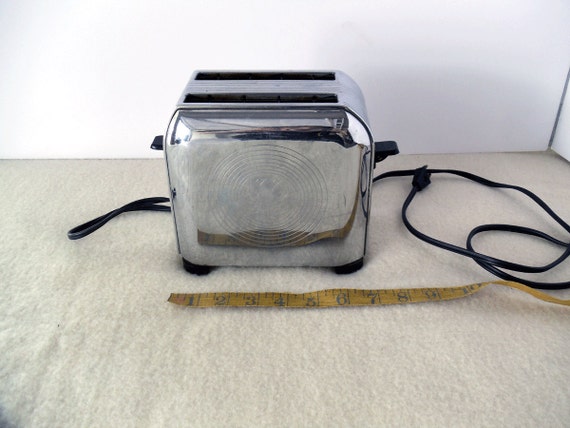
The image size is (570, 428). I want to click on fabric surface, so click(309, 341).